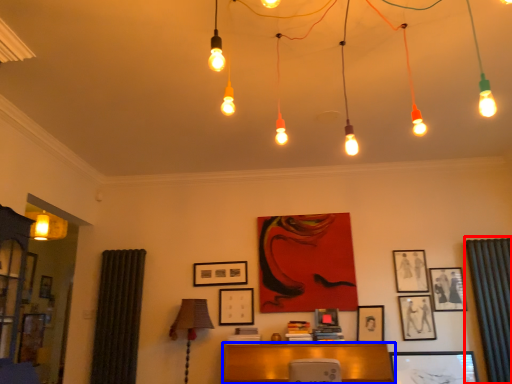
Question: Among these objects, which one is nearest to the camera, curtain (highlighted by a red box) or furniture (highlighted by a blue box)?

Choices:
 (A) curtain
 (B) furniture

Answer: (B)